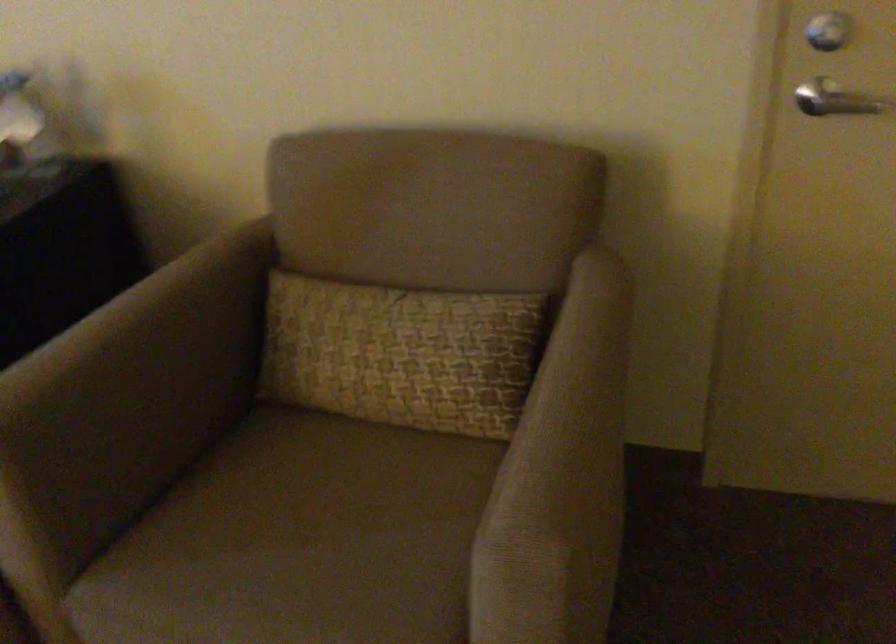
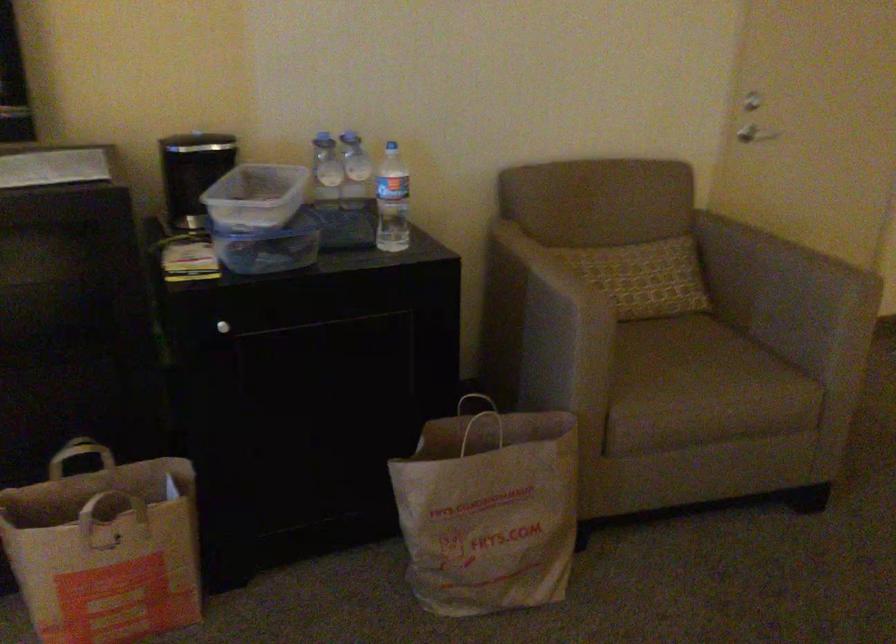
Find the pixel in the second image that matches point 325,567 in the first image.

(707, 366)